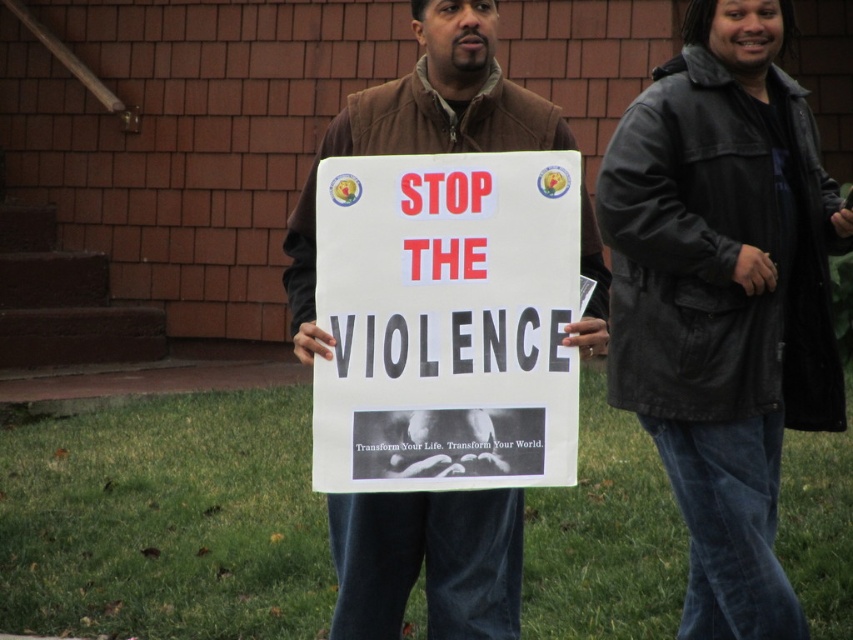
Is point (457, 172) in front of point (491, 579)?

Yes.

Can you confirm if white paper sign at center is smaller than brown leather jacket at center?

Correct, white paper sign at center occupies less space than brown leather jacket at center.

Between point (347, 221) and point (486, 92), which one is positioned in front?

Positioned in front is point (347, 221).

You are a GUI agent. You are given a task and a screenshot of the screen. Output one action in this format:
    pyautogui.click(x=<x>, y=<y>)
    Task: Click on the white paper sign at center
    The width and height of the screenshot is (853, 640).
    Given the screenshot: What is the action you would take?
    pyautogui.click(x=447, y=321)

In the scene shown: Can you confirm if black leather jacket at center is positioned to the right of brown leather jacket at center?

Yes, black leather jacket at center is to the right of brown leather jacket at center.

Between black leather jacket at center and brown leather jacket at center, which one is positioned lower?

black leather jacket at center is lower down.

Who is more distant from viewer, (697, 352) or (396, 125)?

The point (697, 352) is more distant.

The height and width of the screenshot is (640, 853). I want to click on black leather jacket at center, so click(724, 298).

At what (x,y) coordinates should I click in order to perform the action: click on black leather jacket at center. Please return your answer as a coordinate pair (x, y). Looking at the image, I should click on (724, 298).

Is black leather jacket at center shorter than white paper sign at center?

No, black leather jacket at center is not shorter than white paper sign at center.

This screenshot has height=640, width=853. In order to click on black leather jacket at center in this screenshot , I will do `click(724, 298)`.